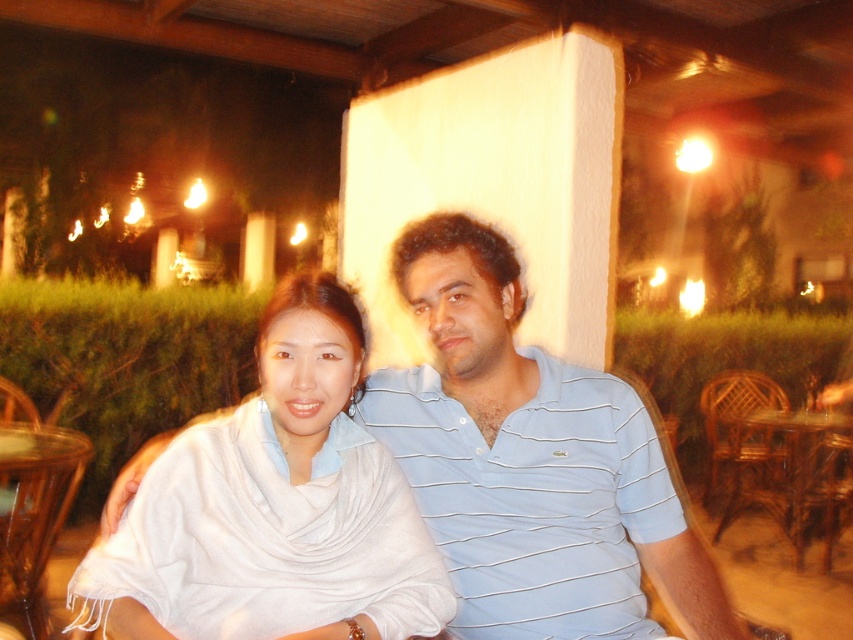
Question: Which point appears closest to the camera in this image?

Choices:
 (A) (627, 544)
 (B) (811, 424)

Answer: (A)

Question: Observing the image, what is the correct spatial positioning of light blue striped polo shirt at center in reference to white silk scarf at center?

Choices:
 (A) above
 (B) below

Answer: (B)

Question: Which point is closer to the camera?

Choices:
 (A) wooden at right
 (B) light blue striped polo shirt at center
 (C) white silk scarf at center
 (D) wooden table at lower left

Answer: (C)

Question: Observing the image, what is the correct spatial positioning of light blue striped polo shirt at center in reference to wooden at right?

Choices:
 (A) below
 (B) above

Answer: (B)

Question: Does light blue striped polo shirt at center lie behind wooden table at lower left?

Choices:
 (A) yes
 (B) no

Answer: (B)

Question: Which point is farther from the camera taking this photo?

Choices:
 (A) (0, 579)
 (B) (354, 552)

Answer: (A)